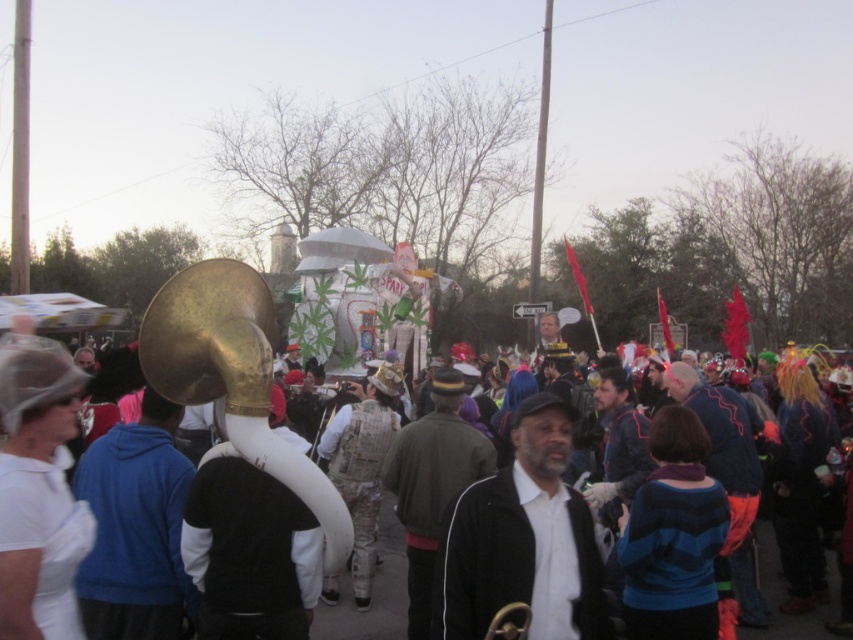
Based on the photo, you are a photographer trying to capture both the black matte jacket at center and the dark green jacket at center in a single frame. Based on their widths, which jacket will occupy more space in the photo?

The black matte jacket at center will occupy more space in the photo because its width surpasses that of the dark green jacket at center.

You are a photographer standing at the back of the crowd. You want to take a photo of both the blue fleece jacket at center and the dark green jacket at center. Which jacket will be partially hidden by the other?

The blue fleece jacket at center will be partially hidden by the dark green jacket at center because the dark green jacket at center is taller than the blue fleece jacket at center.

Consider the image. You are standing in the parade and see the dark green jacket at center and the white matte crowd at center. Which object is positioned higher relative to the other?

The dark green jacket at center is located above the white matte crowd at center, so it is positioned higher.